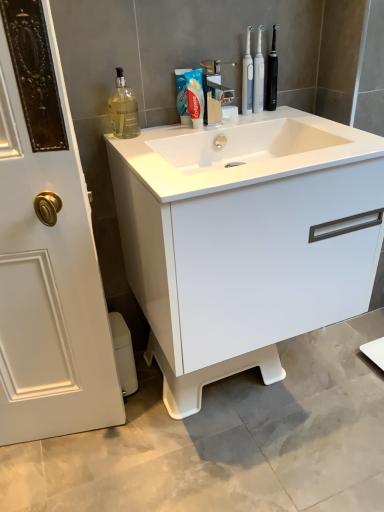
The width and height of the screenshot is (384, 512). Identify the location of unoccupied area in front of clear plastic toothbrushes at upper center. (247, 121).